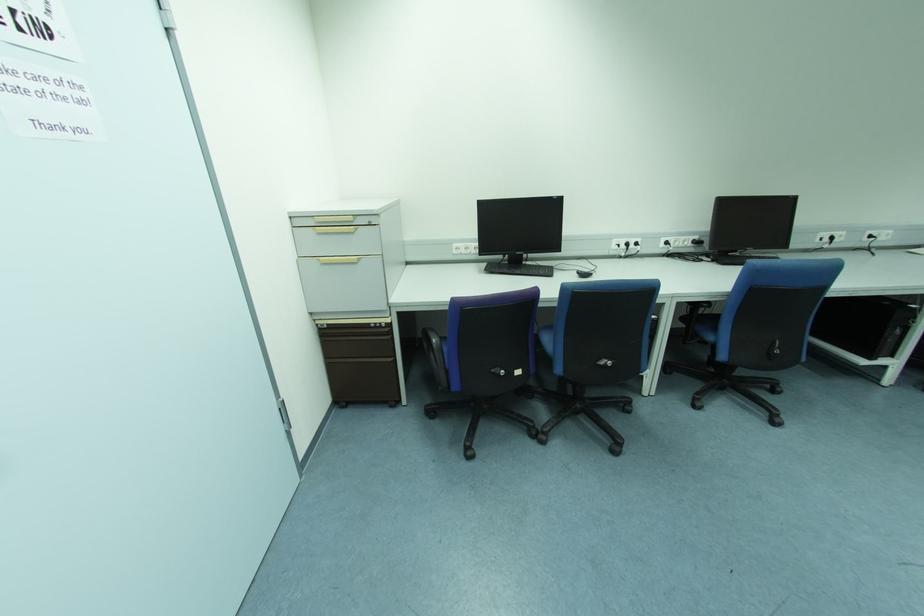
This screenshot has width=924, height=616. What do you see at coordinates (499, 371) in the screenshot? I see `the chair adjustment lever` at bounding box center [499, 371].